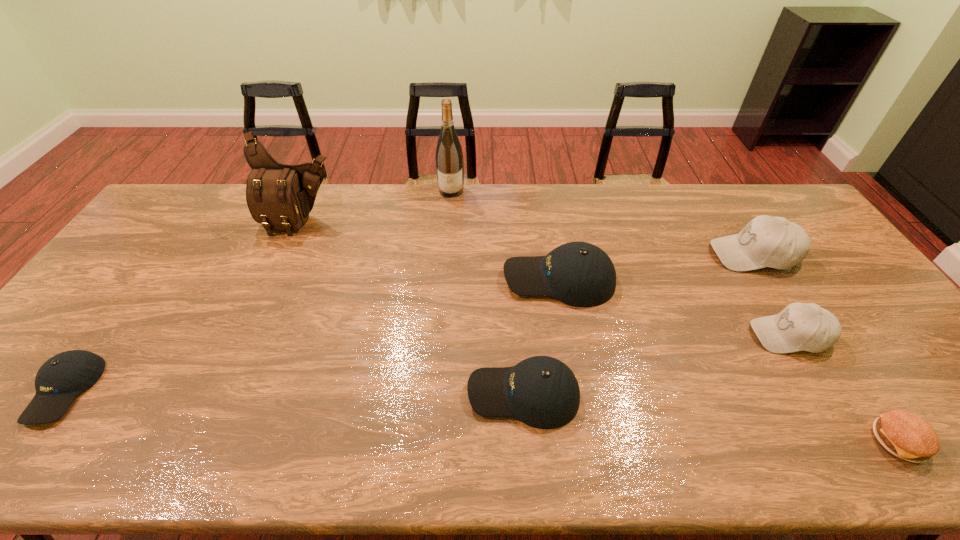
In order to click on free space located 0.100m on the front-facing side of the smaller gray baseball cap in this screenshot , I will do `click(713, 335)`.

I want to click on free spot located on the front-facing side of the smaller gray baseball cap, so 626,335.

You are a GUI agent. You are given a task and a screenshot of the screen. Output one action in this format:
    pyautogui.click(x=<x>, y=<y>)
    Task: Click on the free region located on the front-facing side of the second biggest blue baseball cap
    This screenshot has height=540, width=960.
    Given the screenshot: What is the action you would take?
    pyautogui.click(x=324, y=394)

The height and width of the screenshot is (540, 960). I want to click on free space located on the front-facing side of the second biggest blue baseball cap, so click(371, 394).

The height and width of the screenshot is (540, 960). Find the location of `free space located 0.220m on the front-facing side of the second biggest blue baseball cap`. free space located 0.220m on the front-facing side of the second biggest blue baseball cap is located at coordinates (374, 394).

In order to click on free space located on the left of the hamburger in this screenshot , I will do `click(797, 441)`.

You are a GUI agent. You are given a task and a screenshot of the screen. Output one action in this format:
    pyautogui.click(x=<x>, y=<y>)
    Task: Click on the wine bottle located in the far edge section of the desktop
    
    Given the screenshot: What is the action you would take?
    pyautogui.click(x=449, y=157)

Locate an element on the screen. The width and height of the screenshot is (960, 540). shoulder bag at the far edge is located at coordinates (279, 196).

At what (x,y) coordinates should I click in order to perform the action: click on hamburger that is at the near edge. Please return your answer as a coordinate pair (x, y). The height and width of the screenshot is (540, 960). Looking at the image, I should click on (905, 435).

Where is `object that is at the left edge`? This screenshot has height=540, width=960. object that is at the left edge is located at coordinates (63, 377).